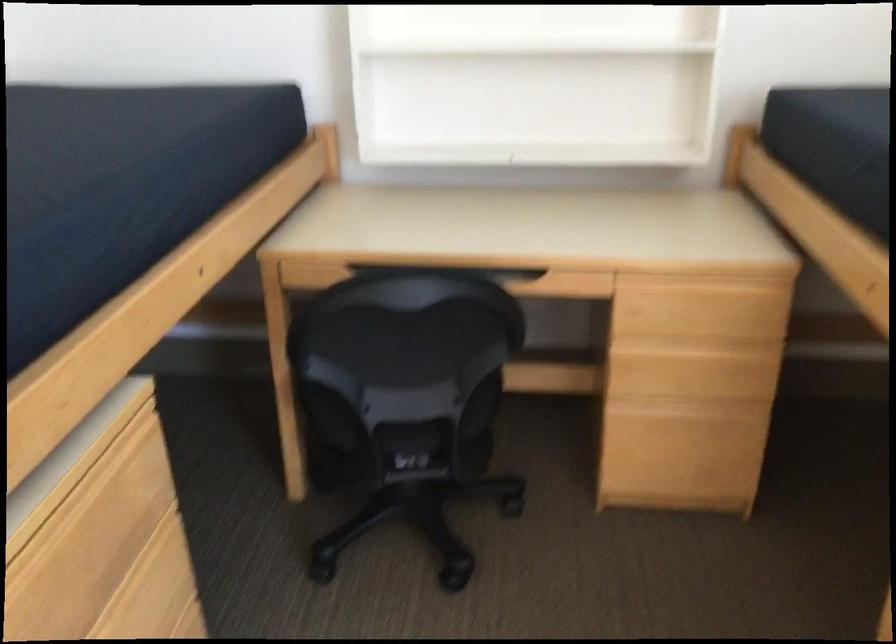
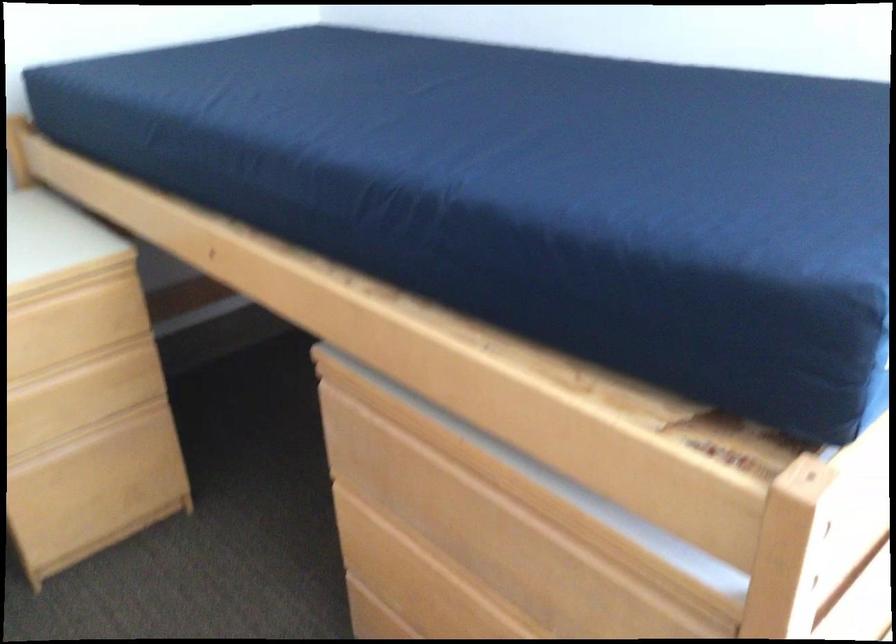
The point at (716, 301) is marked in the first image. Where is the corresponding point in the second image?

(73, 323)